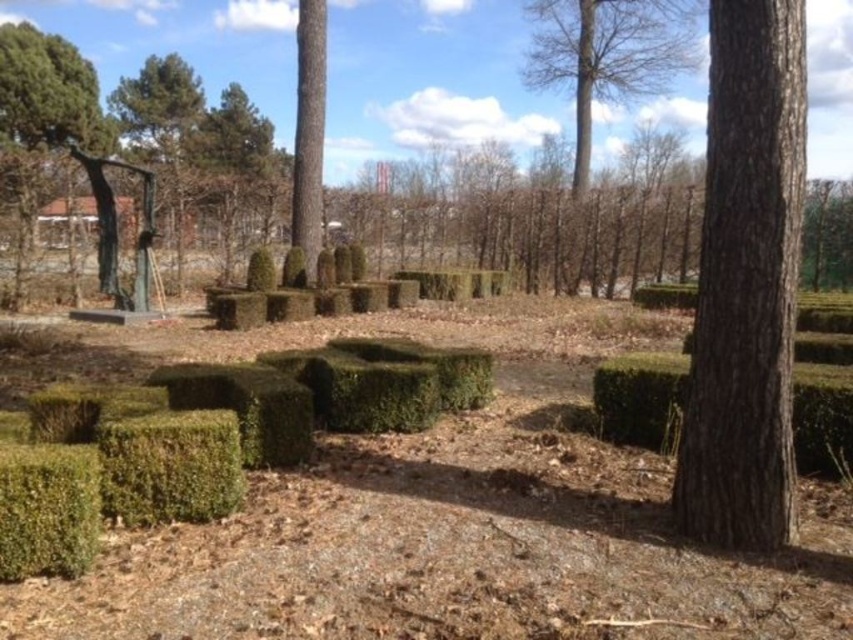
You are standing in the park and see the bare wood tree at upper center and the green leafy bush at lower left. Which object is located higher up in the image?

The bare wood tree at upper center is positioned over the green leafy bush at lower left, so it is higher up in the image.

Looking at this image, you are a gardener planning to plant a new flower bed between the bare wood tree at upper center and the green textured bush at lower left. Based on their positions, which object should you place the flower bed closer to?

The flower bed should be placed closer to the green textured bush at lower left since the bare wood tree at upper center is positioned above it, meaning the bush is lower in the scene.

You are planning to place a small birdhouse between the bare wood tree at upper center and the green textured bush at lower left. Based on their widths, which object should the birdhouse be placed closer to?

The bare wood tree at upper center might be wider than green textured bush at lower left, so the birdhouse should be placed closer to the green textured bush at lower left to ensure it is visible and not overshadowed by the wider tree.